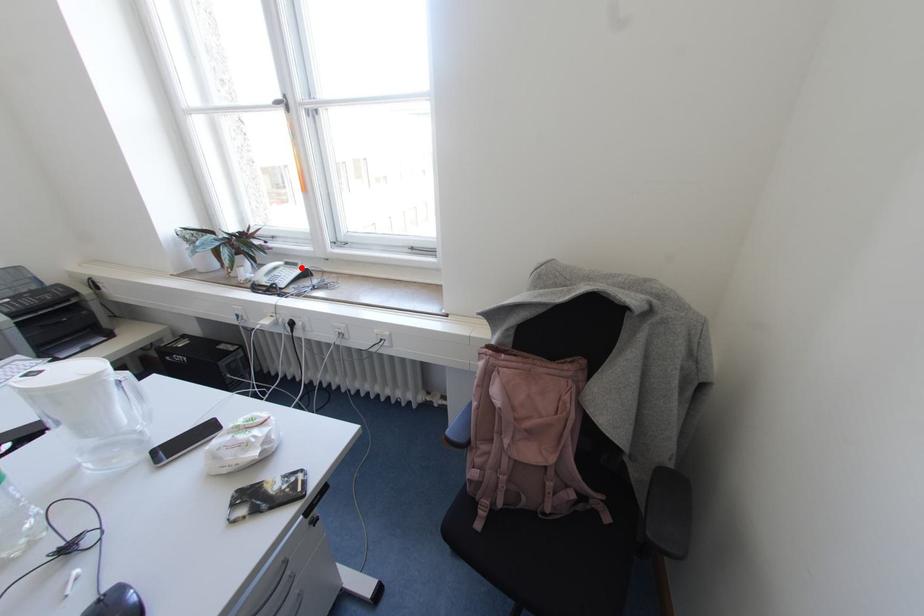
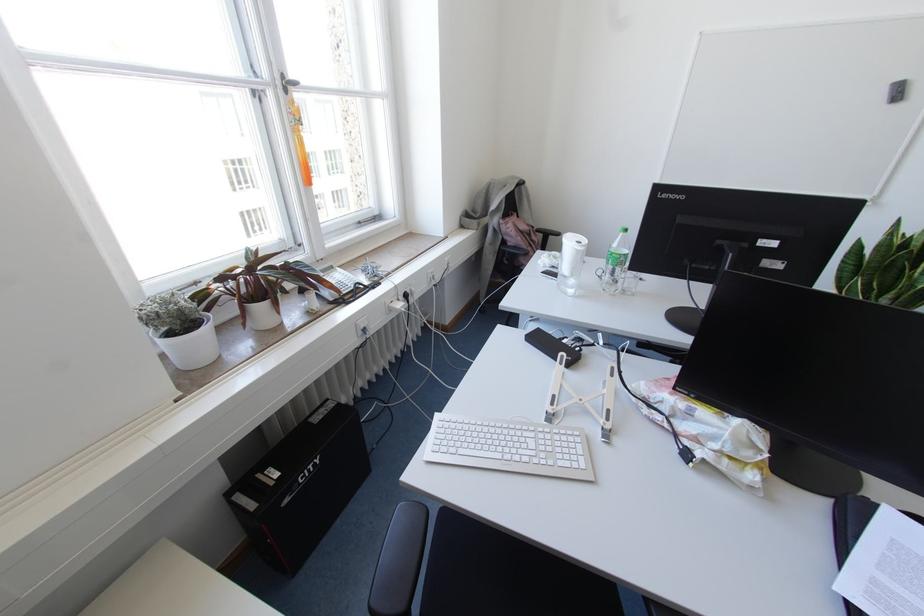
Locate, in the second image, the point that corresponds to the highlighted location in the first image.

(336, 268)